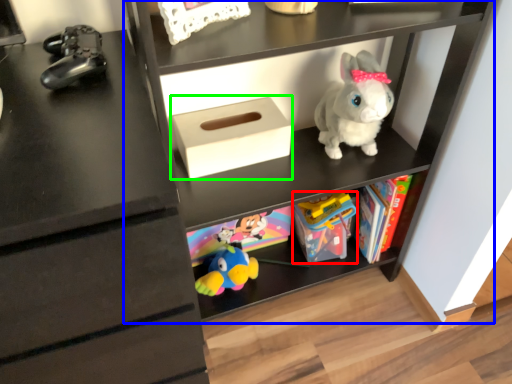
Question: Estimate the real-world distances between objects in this image. Which object is farther from toy (highlighted by a red box), shelf (highlighted by a blue box) or shoe box (highlighted by a green box)?

Choices:
 (A) shelf
 (B) shoe box

Answer: (B)